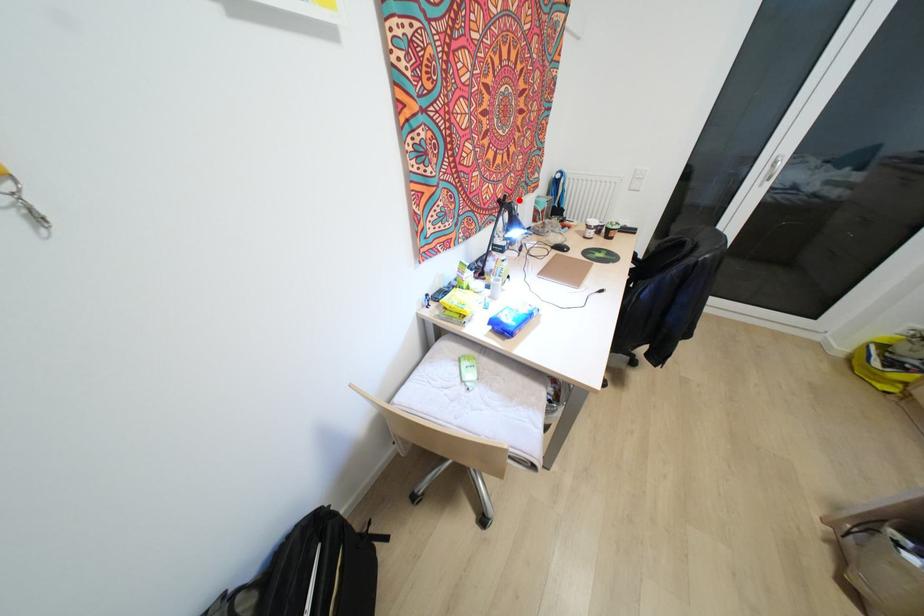
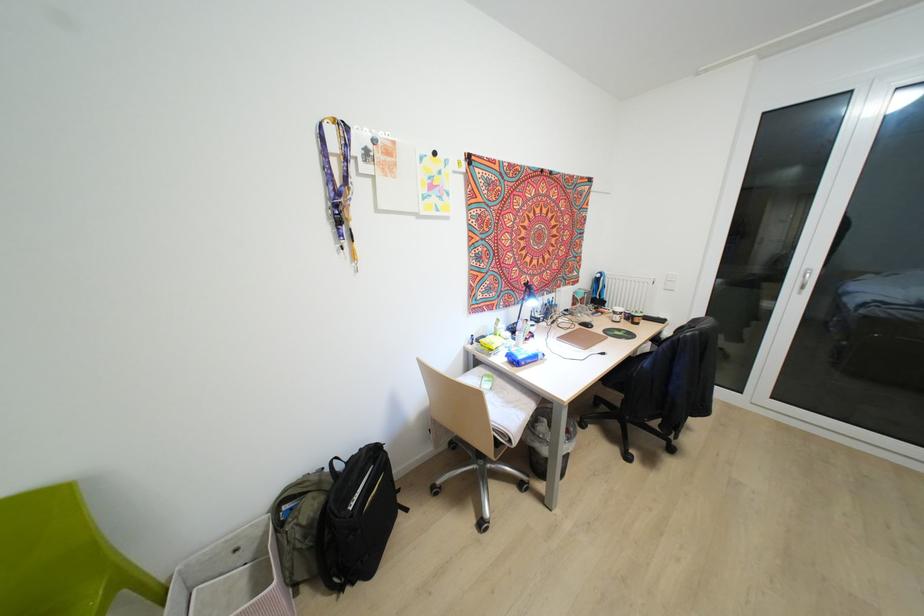
Where in the second image is the point corresponding to the highlighted location from the first image?

(556, 289)